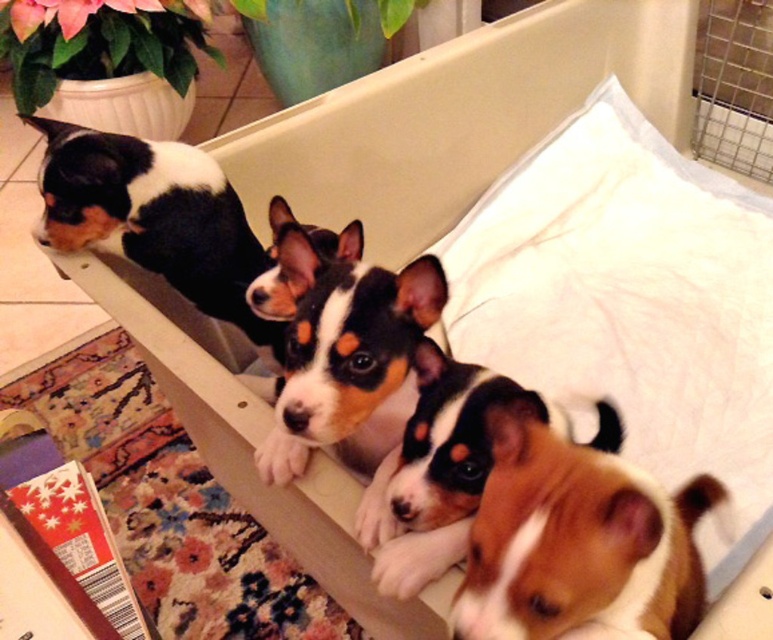
Can you confirm if white soft pillow at upper right is taller than brown furry dog at lower right?

Yes, white soft pillow at upper right is taller than brown furry dog at lower right.

Who is shorter, white soft pillow at upper right or brown furry dog at lower right?

brown furry dog at lower right is shorter.

Is point (525, 372) positioned before point (652, 630)?

No, it is behind (652, 630).

The width and height of the screenshot is (773, 640). Identify the location of white soft pillow at upper right. (630, 304).

Does brown furry dog at lower right have a lesser width compared to black and white fur at center?

No.

Is brown furry dog at lower right closer to the viewer compared to black and white fur at center?

Yes, it is.

Is point (671, 636) closer to viewer compared to point (431, 296)?

Yes, it is in front of point (431, 296).

At what (x,y) coordinates should I click in order to perform the action: click on brown furry dog at lower right. Please return your answer as a coordinate pair (x, y). The image size is (773, 640). Looking at the image, I should click on (577, 544).

Who is more forward, (494, 456) or (133, 227)?

Point (494, 456) is in front.

Between brown furry dog at lower right and black and white fur at upper left, which one is positioned lower?

brown furry dog at lower right is lower down.

Who is more distant from viewer, (487,624) or (193,163)?

Point (193,163)

Where is `brown furry dog at lower right`? The image size is (773, 640). brown furry dog at lower right is located at coordinates (577, 544).